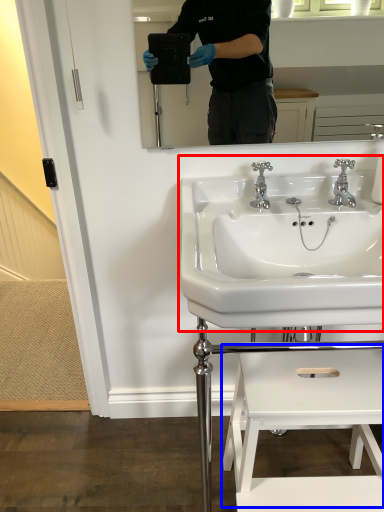
Question: Which object is closer to the camera taking this photo, sink (highlighted by a red box) or step stool (highlighted by a blue box)?

Choices:
 (A) sink
 (B) step stool

Answer: (A)